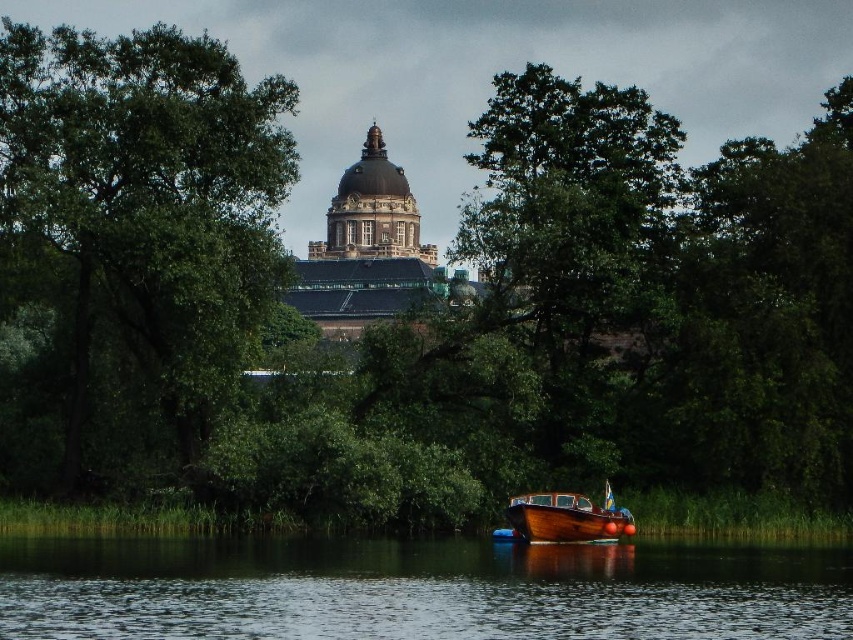
Which is more to the left, green leafy tree at left or transparent water at lower center?

From the viewer's perspective, green leafy tree at left appears more on the left side.

Which is behind, point (4, 97) or point (148, 586)?

Point (4, 97)

Where is `green leafy tree at left`? green leafy tree at left is located at coordinates (129, 244).

Which is in front, point (306, 563) or point (590, 531)?

Point (306, 563)

Between point (795, 577) and point (619, 508), which one is positioned behind?

The point (619, 508) is more distant.

This screenshot has width=853, height=640. Find the location of `transparent water at lower center`. transparent water at lower center is located at coordinates (416, 588).

Who is more distant from viewer, (107,100) or (624,522)?

Point (107,100)

Who is positioned more to the left, green leafy tree at left or wooden boat at lower center?

green leafy tree at left

Is point (181, 65) less distant than point (561, 541)?

No, it is behind (561, 541).

Locate an element on the screen. green leafy tree at left is located at coordinates (129, 244).